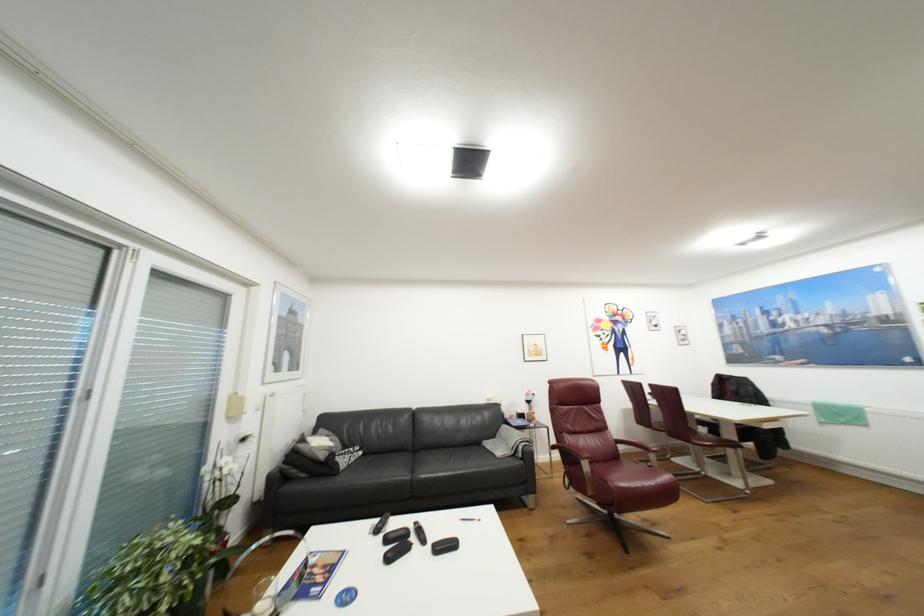
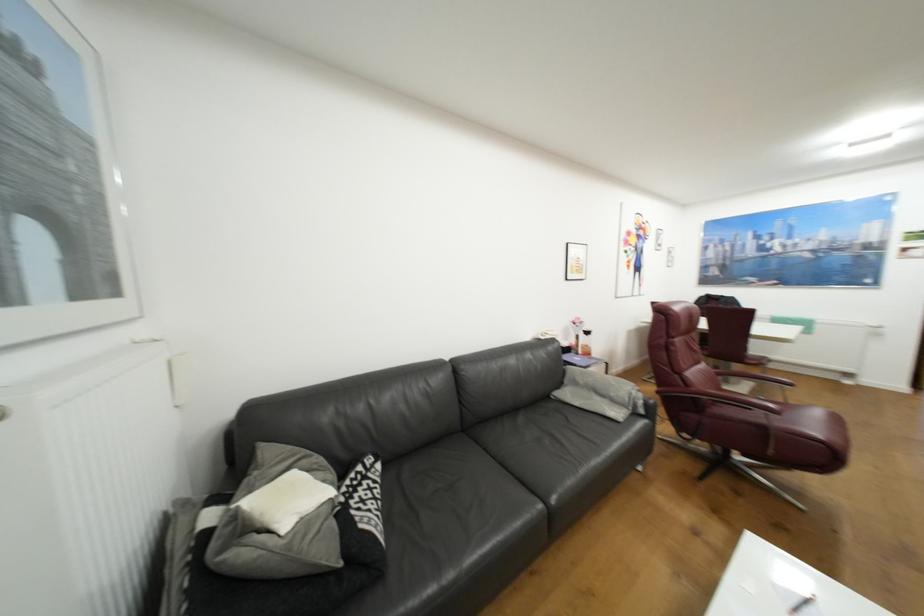
In a continuous first-person perspective shot, in which direction is the camera moving?

The cameraman moved toward left, forward.